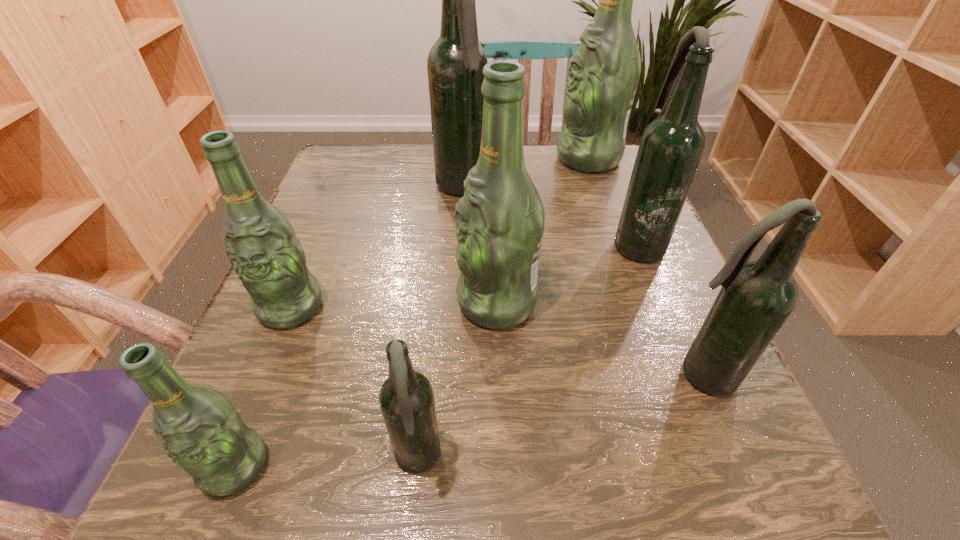
You are a GUI agent. You are given a task and a screenshot of the screen. Output one action in this format:
    pyautogui.click(x=<x>, y=<y>)
    Task: Click on the farthest green beer bottle
    Image resolution: width=960 pixels, height=540 pixels.
    Given the screenshot: What is the action you would take?
    pyautogui.click(x=602, y=79)

The width and height of the screenshot is (960, 540). I want to click on the rightmost green beer bottle, so click(x=602, y=79).

The height and width of the screenshot is (540, 960). In order to click on the biggest dark beer bottle in this screenshot , I will do `click(455, 63)`.

The width and height of the screenshot is (960, 540). In order to click on the third smallest dark beer bottle in this screenshot , I will do `click(671, 146)`.

The height and width of the screenshot is (540, 960). I want to click on the second farthest dark beer bottle, so click(671, 146).

Where is `the third smallest green beer bottle`? The image size is (960, 540). the third smallest green beer bottle is located at coordinates (500, 220).

Where is `the second smallest green beer bottle`? This screenshot has width=960, height=540. the second smallest green beer bottle is located at coordinates (261, 245).

I want to click on the second smallest dark beer bottle, so click(756, 298).

Find the location of a particular element. The height and width of the screenshot is (540, 960). the third farthest dark beer bottle is located at coordinates (756, 298).

Where is `the smallest dark beer bottle`? The width and height of the screenshot is (960, 540). the smallest dark beer bottle is located at coordinates (406, 398).